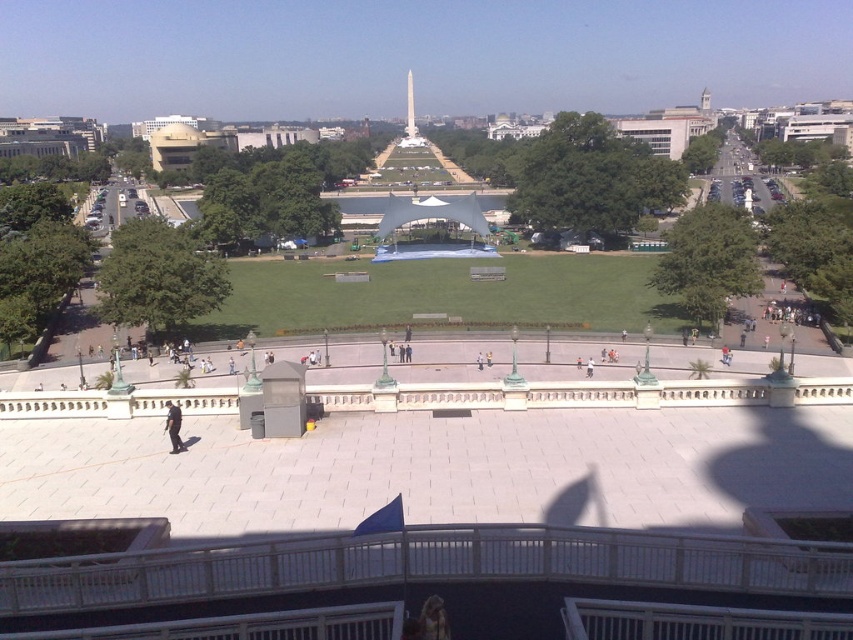
You are a visitor in the park and want to find the shiny gold monument at center. You see the black uniformed officer at lower left. Which direction should you move relative to the officer to reach the monument?

The shiny gold monument at center is to the left of the black uniformed officer at lower left, so you should move to the left relative to the officer to reach the monument.